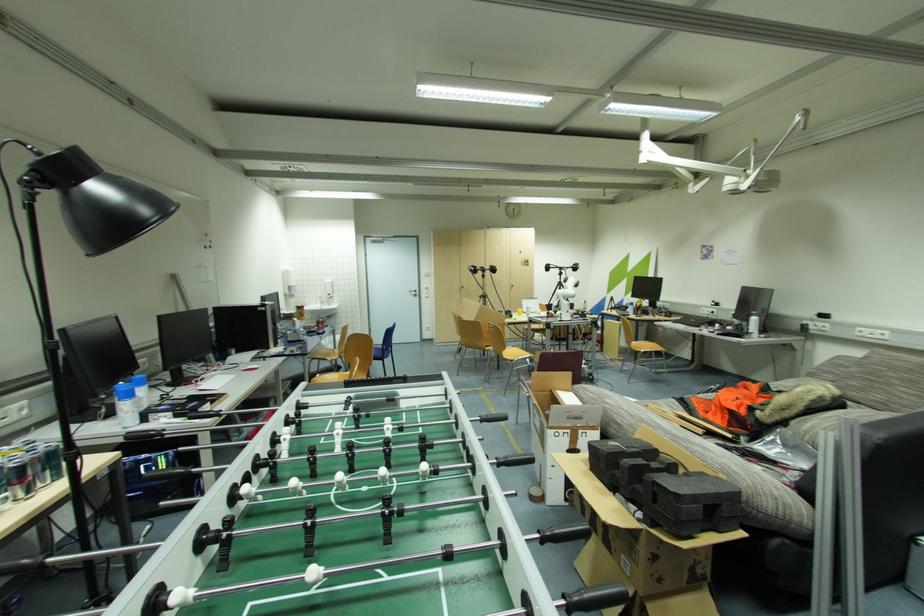
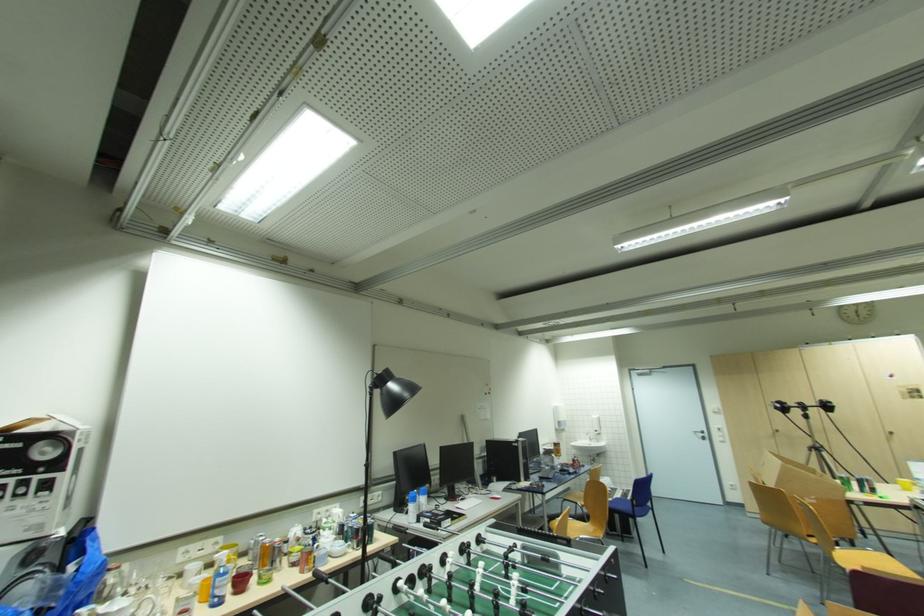
In the second image, find the point that corresponds to point 333,297 in the first image.

(601, 434)